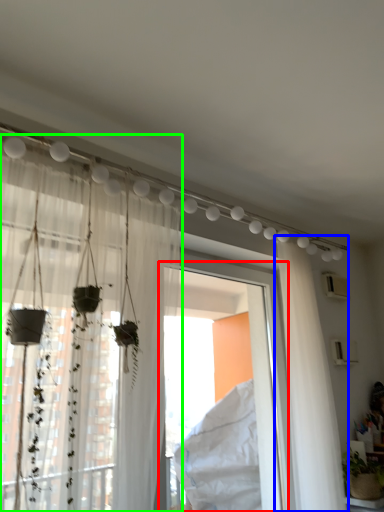
Question: Estimate the real-world distances between objects in this image. Which object is closer to window frame (highlighted by a red box), curtain (highlighted by a blue box) or curtain (highlighted by a green box)?

Choices:
 (A) curtain
 (B) curtain

Answer: (A)